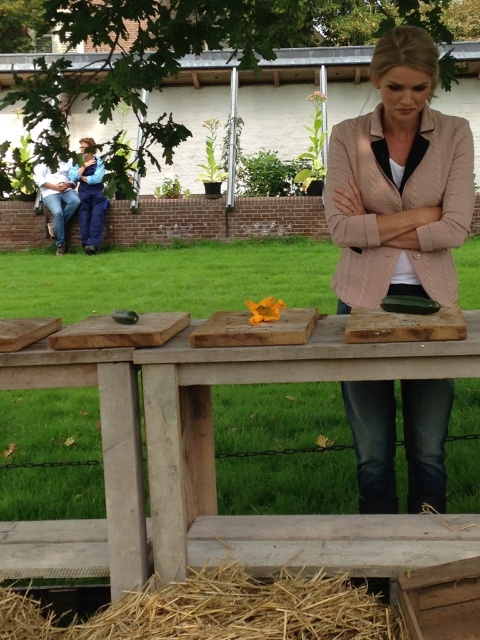
You are a person who is 1.7 meters tall. You are standing in front of the wooden picnic table at center and the blue denim jacket at left. If you want to place a book on top of the taller object, which one should you choose?

The blue denim jacket at left is taller than the wooden picnic table at center, so you should place the book on the blue denim jacket at left.

You are a chef preparing vegetables and need to move the wooden cutting board at center to the left to make space. Is there enough room to move it left without overlapping with the golden straw at lower center?

The golden straw at lower center is to the right of the wooden cutting board at center, so moving the wooden cutting board at center to the left would not overlap with the golden straw at lower center as there is space between them.

Looking at this image, you are standing in front of the rustic wooden table and want to pick up an item from the table. You notice two points marked on the table surface. Which point is closer to you, point (363,602) or point (115,316)?

Point (363,602) is closer to you than point (115,316).